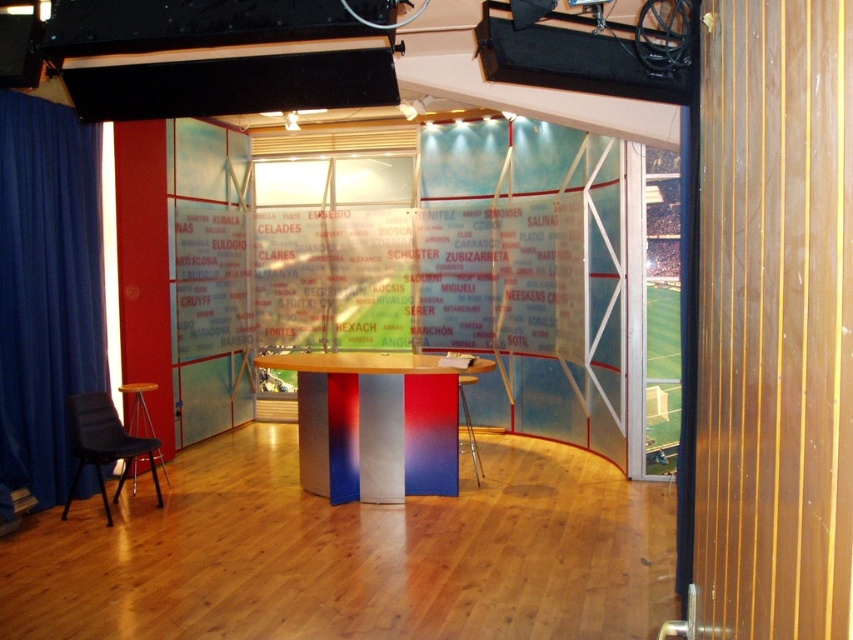
Who is positioned more to the right, blue fabric curtain at left or metallic gradient table at center?

metallic gradient table at center is more to the right.

In the scene shown: Between blue fabric curtain at left and metallic gradient table at center, which one is positioned higher?

Positioned higher is blue fabric curtain at left.

Who is more forward, (47, 221) or (418, 369)?

Point (418, 369) is in front.

Find the location of a particular element. blue fabric curtain at left is located at coordinates 45,289.

Is black fabric chair at lower left behind wooden stool at lower left?

No, it is in front of wooden stool at lower left.

Is black fabric chair at lower left smaller than wooden stool at lower left?

No, black fabric chair at lower left is not smaller than wooden stool at lower left.

Locate an element on the screen. black fabric chair at lower left is located at coordinates (103, 444).

Does metallic gradient table at center appear on the right side of metallic stool at center?

In fact, metallic gradient table at center is to the left of metallic stool at center.

Based on the photo, can you confirm if metallic gradient table at center is bigger than metallic stool at center?

Yes, metallic gradient table at center is bigger than metallic stool at center.

The width and height of the screenshot is (853, 640). I want to click on metallic gradient table at center, so click(x=375, y=422).